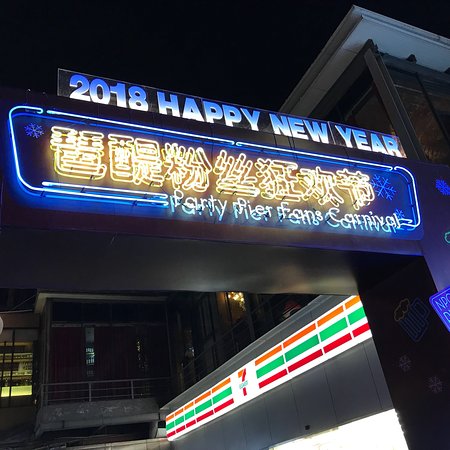
At what (x,y) coordinates should I click in order to perform the action: click on window. Please return your answer as a coordinate pair (x, y). The image size is (450, 450). Looking at the image, I should click on (98, 348).